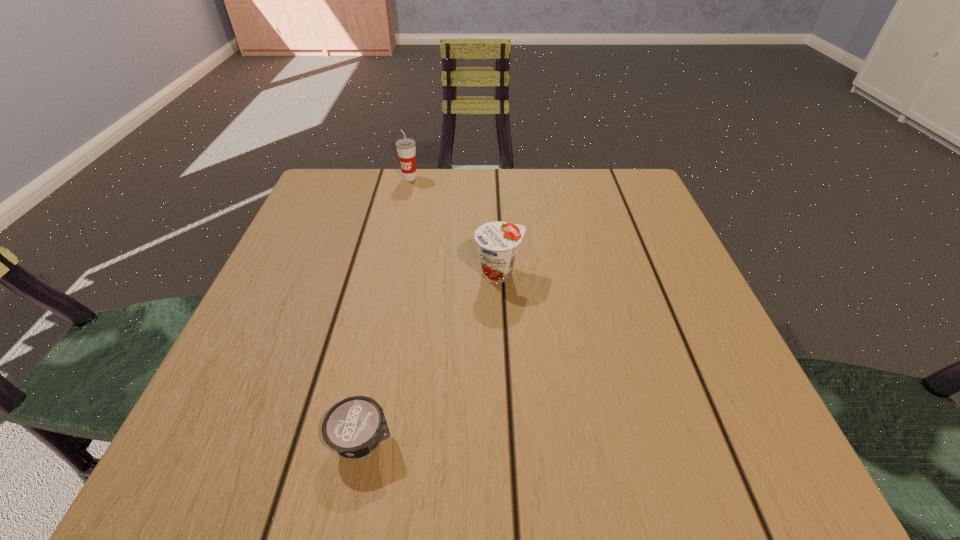
You are a GUI agent. You are given a task and a screenshot of the screen. Output one action in this format:
    pyautogui.click(x=<x>, y=<y>)
    Task: Click on the tallest object
    
    Given the screenshot: What is the action you would take?
    pyautogui.click(x=406, y=149)

The height and width of the screenshot is (540, 960). Identify the location of the farthest object. (406, 149).

Where is `the second tallest object`? This screenshot has width=960, height=540. the second tallest object is located at coordinates (497, 241).

Where is `the right yogurt`? This screenshot has height=540, width=960. the right yogurt is located at coordinates (497, 241).

Locate an element on the screen. Image resolution: width=960 pixels, height=540 pixels. the nearest object is located at coordinates (353, 427).

You are a GUI agent. You are given a task and a screenshot of the screen. Output one action in this format:
    pyautogui.click(x=<x>, y=<y>)
    Task: Click on the shortest object
    Image resolution: width=960 pixels, height=540 pixels.
    Given the screenshot: What is the action you would take?
    pyautogui.click(x=353, y=427)

Locate an element on the screen. This screenshot has width=960, height=540. vacant area situated 0.360m on the side of the farthest object with the logo is located at coordinates (x=386, y=285).

In order to click on vacant space situated on the right of the second nearest object in this screenshot , I will do `click(676, 273)`.

Find the location of `vacant space located on the back of the shorter yogurt`. vacant space located on the back of the shorter yogurt is located at coordinates (374, 383).

Locate an element on the screen. Image resolution: width=960 pixels, height=540 pixels. object located at the far edge is located at coordinates (406, 149).